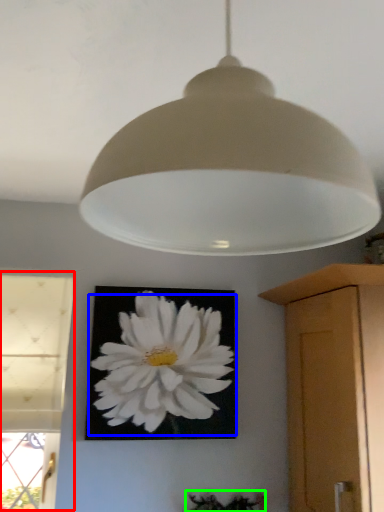
Question: Which object is the closest to the window (highlighted by a red box)? Choose among these: flower (highlighted by a blue box) or plant (highlighted by a green box).

Choices:
 (A) flower
 (B) plant

Answer: (A)